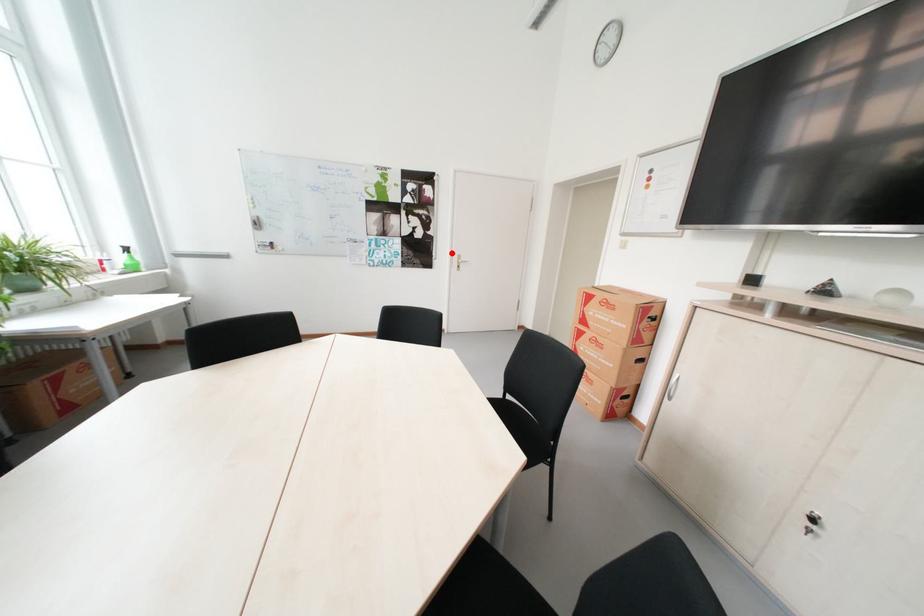
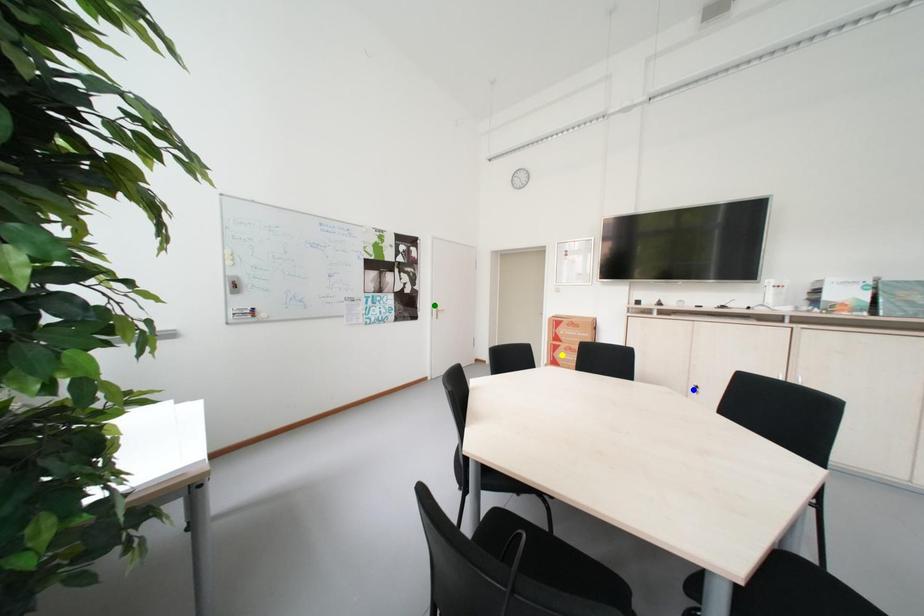
Question: I am providing you with two images of the same scene from different viewpoints. A red point is marked on the first image. You are given multiple points on the second image. Which point in image 2 is actually the same real-world point as the red point in image 1?

Choices:
 (A) blue point
 (B) green point
 (C) yellow point

Answer: (B)